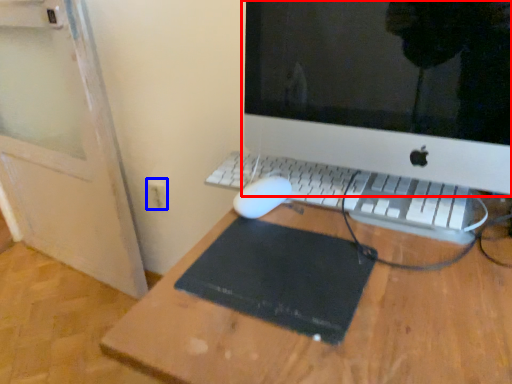
Question: Among these objects, which one is nearest to the camera, computer monitor (highlighted by a red box) or electric outlet (highlighted by a blue box)?

Choices:
 (A) computer monitor
 (B) electric outlet

Answer: (A)